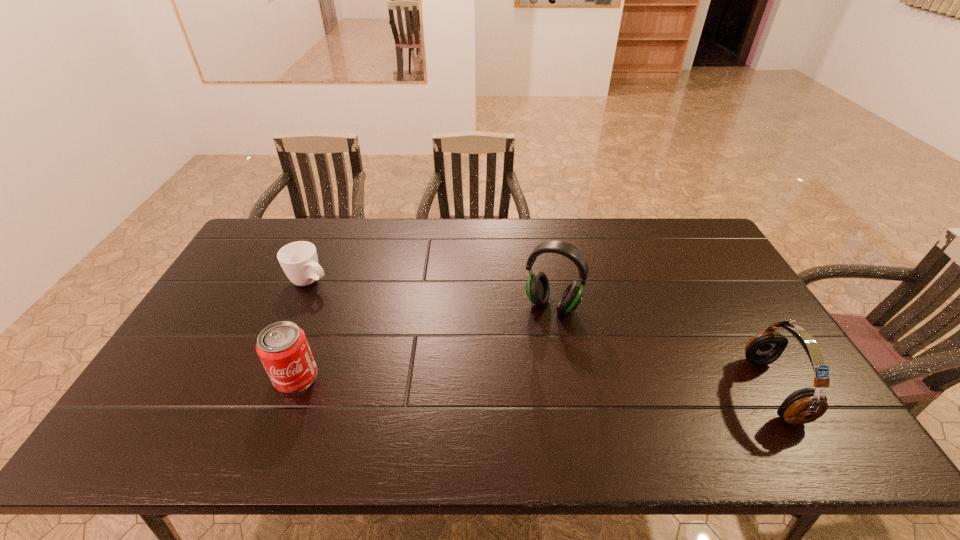
Where is `vacant space on the desktop that is between the second shortest object and the right headset and is positioned with the handle on the side of the cup`? The width and height of the screenshot is (960, 540). vacant space on the desktop that is between the second shortest object and the right headset and is positioned with the handle on the side of the cup is located at coordinates point(499,382).

Identify the location of free space on the desktop that is between the can and the rightmost object and is positioned on the ear cups of the tallest object. The image size is (960, 540). (517, 383).